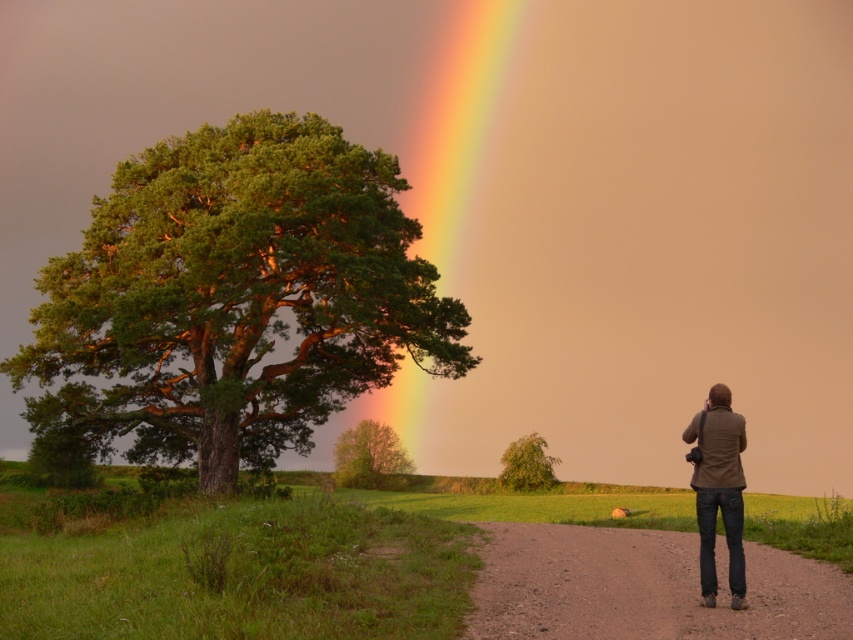
You are a hiker standing on the dirt path in the foreground of the scene. You see the green textured tree at left and the green matte tree at center. Which tree appears closer to you based on their positions in the image?

The green matte tree at center appears closer to you because it is positioned lower in the frame than the green textured tree at left, which is located above it.